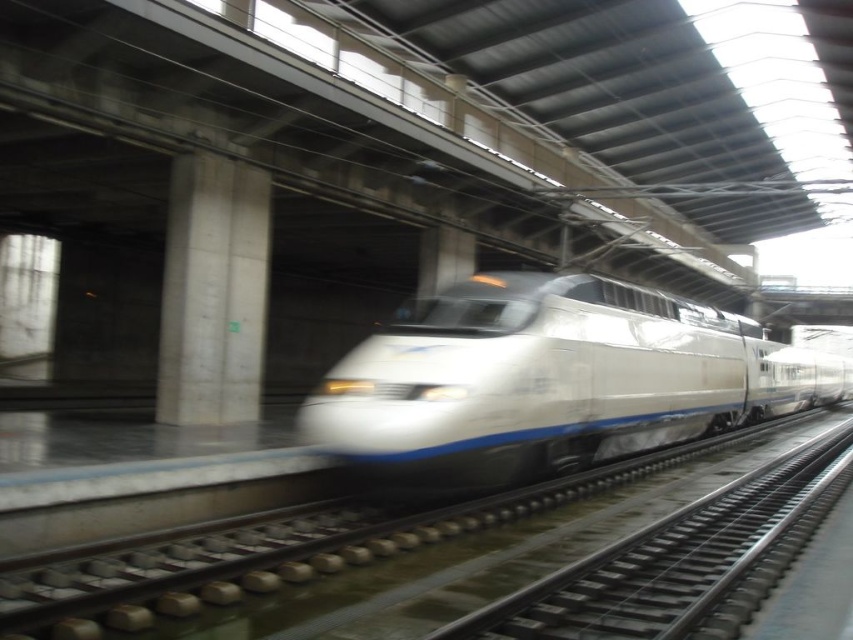
Image resolution: width=853 pixels, height=640 pixels. What do you see at coordinates (549, 380) in the screenshot?
I see `white glossy train at center` at bounding box center [549, 380].

Between point (352, 362) and point (816, 442), which one is positioned behind?

The point (816, 442) is behind.

The height and width of the screenshot is (640, 853). Describe the element at coordinates (549, 380) in the screenshot. I see `white glossy train at center` at that location.

The height and width of the screenshot is (640, 853). I want to click on white glossy train at center, so click(549, 380).